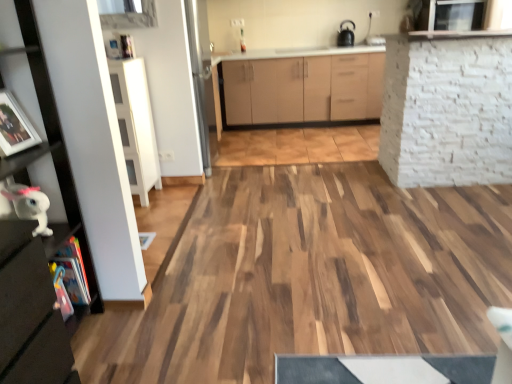
Question: Which direction should I rotate to look at matte wood cabinetry at center, which ranks as the 2th cabinetry in left-to-right order, — up or down?

Choices:
 (A) up
 (B) down

Answer: (A)

Question: Does black matte kettle at upper center have a greater height compared to white brick wall at upper right?

Choices:
 (A) yes
 (B) no

Answer: (B)

Question: From the image's perspective, is black matte kettle at upper center on top of white brick wall at upper right?

Choices:
 (A) yes
 (B) no

Answer: (A)

Question: Does black matte kettle at upper center have a larger size compared to white brick wall at upper right?

Choices:
 (A) yes
 (B) no

Answer: (B)

Question: Would you say black matte kettle at upper center contains white brick wall at upper right?

Choices:
 (A) yes
 (B) no

Answer: (B)

Question: From the image's perspective, is black matte kettle at upper center under white brick wall at upper right?

Choices:
 (A) no
 (B) yes

Answer: (A)

Question: From a real-world perspective, is black matte kettle at upper center located beneath white brick wall at upper right?

Choices:
 (A) no
 (B) yes

Answer: (A)

Question: Is the depth of matte wood cabinetry at center, which ranks as the 1th cabinetry in top-to-bottom order, greater than that of black matte kettle at upper center?

Choices:
 (A) no
 (B) yes

Answer: (A)

Question: From the image's perspective, is matte wood cabinetry at center, the 1th cabinetry positioned from the right, below black matte kettle at upper center?

Choices:
 (A) no
 (B) yes

Answer: (B)

Question: Is matte wood cabinetry at center, which is the first cabinetry from back to front, not inside black matte kettle at upper center?

Choices:
 (A) no
 (B) yes

Answer: (B)

Question: Considering the relative sizes of matte wood cabinetry at center, the 1th cabinetry positioned from the right, and black matte kettle at upper center in the image provided, is matte wood cabinetry at center, the 1th cabinetry positioned from the right, smaller than black matte kettle at upper center?

Choices:
 (A) no
 (B) yes

Answer: (A)

Question: Does matte wood cabinetry at center, which ranks as the 1th cabinetry in top-to-bottom order, appear on the left side of black matte kettle at upper center?

Choices:
 (A) yes
 (B) no

Answer: (A)

Question: Is matte wood cabinetry at center, arranged as the second cabinetry when viewed from the front, positioned before black matte kettle at upper center?

Choices:
 (A) no
 (B) yes

Answer: (B)

Question: From the image's perspective, would you say white glossy sink at upper center is positioned over white glossy plush toy at lower left?

Choices:
 (A) no
 (B) yes

Answer: (B)